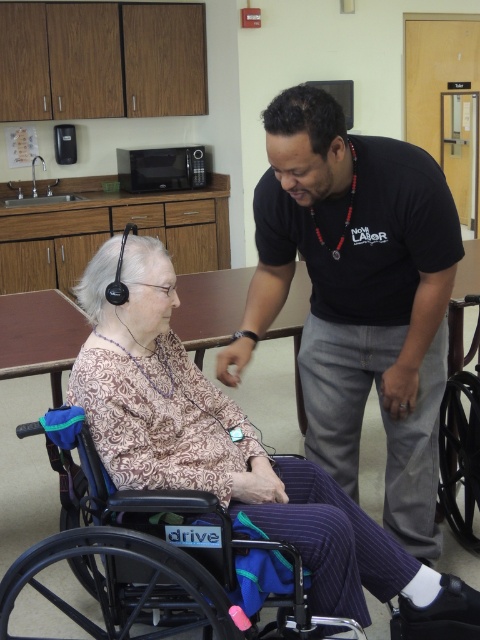
You are a photographer setting up for a group photo. You need to ensure that the black cotton shirt at center and the black plastic wheelchair at lower right are both visible in the frame. Given their height difference, which object might block the view of the other if positioned directly in front?

The black cotton shirt at center is taller than the black plastic wheelchair at lower right, so if positioned directly in front, the black cotton shirt at center could block the view of the black plastic wheelchair at lower right.